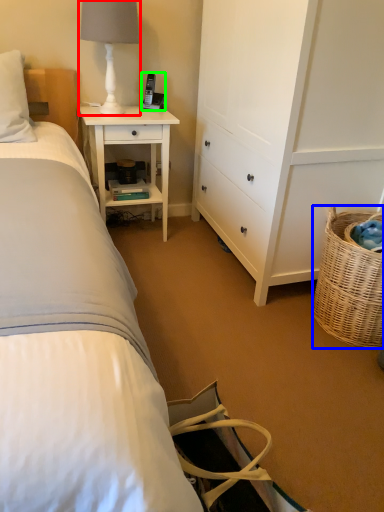
Question: Which is nearer to the table lamp (highlighted by a red box)? picnic basket (highlighted by a blue box) or corded phone (highlighted by a green box).

Choices:
 (A) picnic basket
 (B) corded phone

Answer: (B)